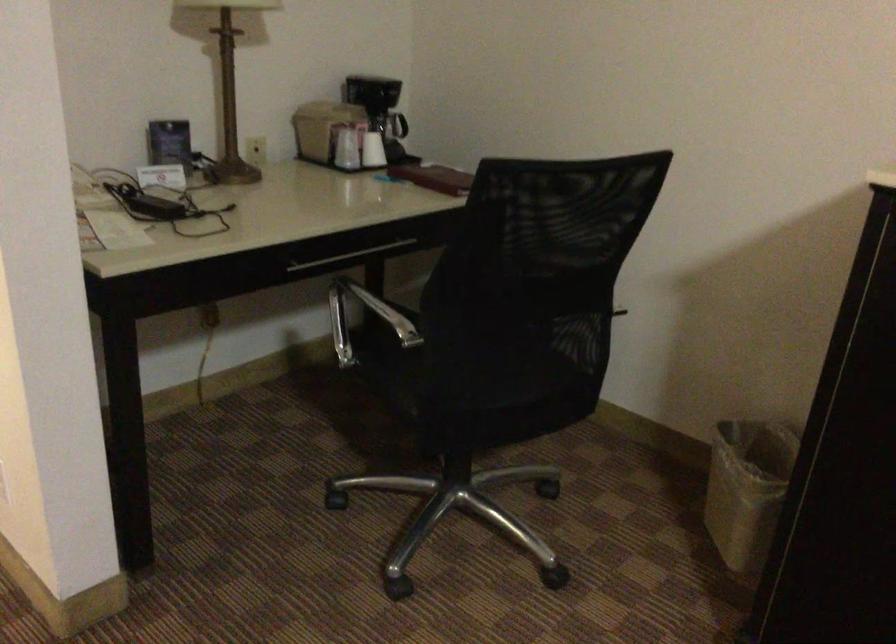
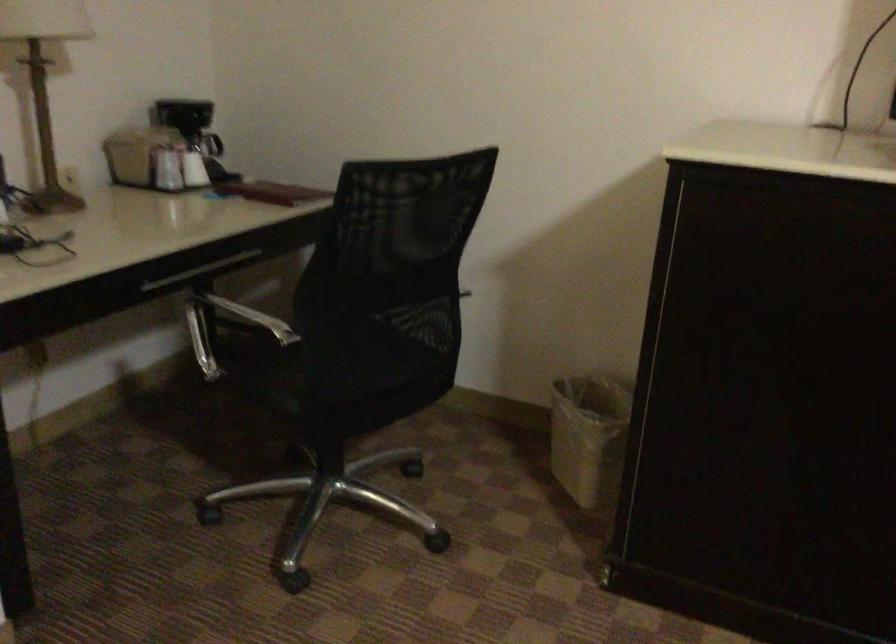
The point at (371, 153) is marked in the first image. Where is the corresponding point in the second image?

(194, 169)